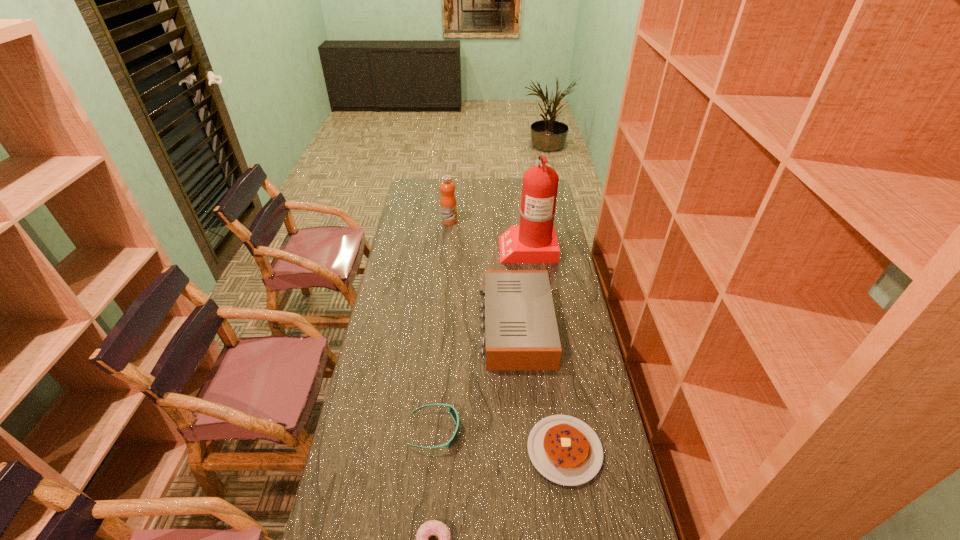
Point out which object is positioned as the nearest to the sunglasses. Please provide its 2D coordinates. Your answer should be formatted as a tuple, i.e. [(x, y)], where the tuple contains the x and y coordinates of a point satisfying the conditions above.

[(521, 333)]

This screenshot has height=540, width=960. I want to click on object that is the fifth closest to the pancake, so click(x=448, y=205).

The width and height of the screenshot is (960, 540). I want to click on vacant space that satisfies the following two spatial constraints: 1. on the front panel of the fourth shortest object; 2. on the right side of the pancake, so click(x=525, y=450).

You are a GUI agent. You are given a task and a screenshot of the screen. Output one action in this format:
    pyautogui.click(x=<x>, y=<y>)
    Task: Click on the vacant point that satisfies the following two spatial constraints: 1. on the front panel of the fourth shortest object; 2. on the left side of the pancake
    
    Given the screenshot: What is the action you would take?
    pyautogui.click(x=525, y=450)

Image resolution: width=960 pixels, height=540 pixels. In order to click on free space that satisfies the following two spatial constraints: 1. on the front-facing side of the fire extinguisher; 2. on the back side of the pancake in this screenshot , I will do `click(554, 450)`.